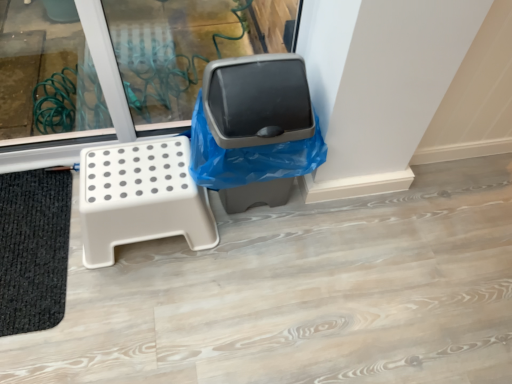
Image resolution: width=512 pixels, height=384 pixels. Identify the location of vacant space in front of white plastic stool at left. (134, 315).